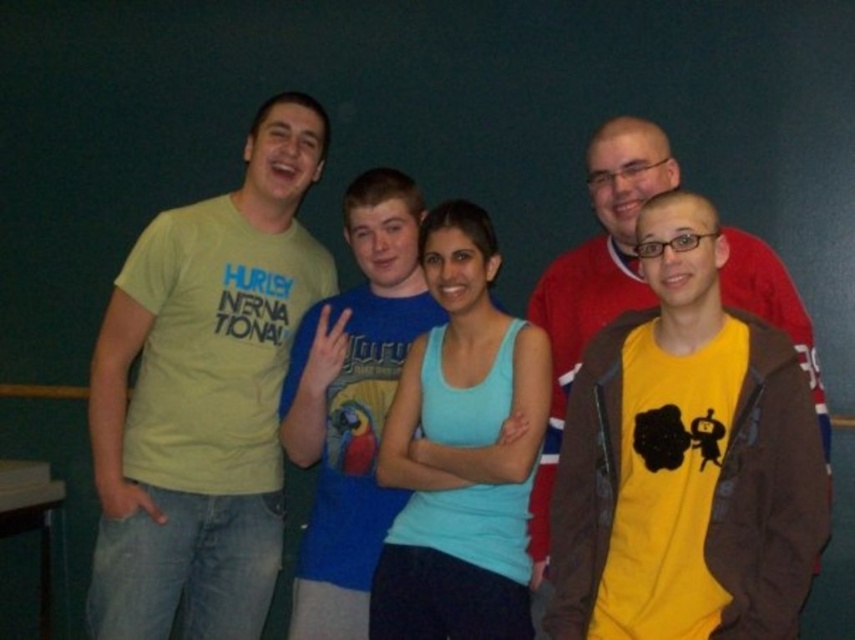
Does matte yellow t-shirt at left have a greater height compared to blue cotton t-shirt at center?

Yes.

This screenshot has width=855, height=640. What do you see at coordinates (204, 394) in the screenshot? I see `matte yellow t-shirt at left` at bounding box center [204, 394].

Is point (136, 497) more distant than point (369, 529)?

Yes, it is behind point (369, 529).

At what (x,y) coordinates should I click in order to perform the action: click on matte yellow t-shirt at left. Please return your answer as a coordinate pair (x, y). Looking at the image, I should click on (204, 394).

Between point (494, 358) and point (555, 333), which one is positioned in front?

Point (494, 358) is more forward.

Does light blue tank top at center have a lesser width compared to yellow matte shirt at right?

Correct, light blue tank top at center's width is less than yellow matte shirt at right's.

Is point (457, 392) positioned in front of point (632, 216)?

That is True.

Locate an element on the screen. The image size is (855, 640). light blue tank top at center is located at coordinates point(460,451).

Between matte yellow t-shirt at left and yellow matte shirt at right, which one appears on the left side from the viewer's perspective?

Positioned to the left is matte yellow t-shirt at left.

Where is `matte yellow t-shirt at left`? This screenshot has height=640, width=855. matte yellow t-shirt at left is located at coordinates (204, 394).

This screenshot has height=640, width=855. What are the coordinates of `matte yellow t-shirt at left` in the screenshot? It's located at (x=204, y=394).

Where is `matte yellow t-shirt at left`? The width and height of the screenshot is (855, 640). matte yellow t-shirt at left is located at coordinates (204, 394).